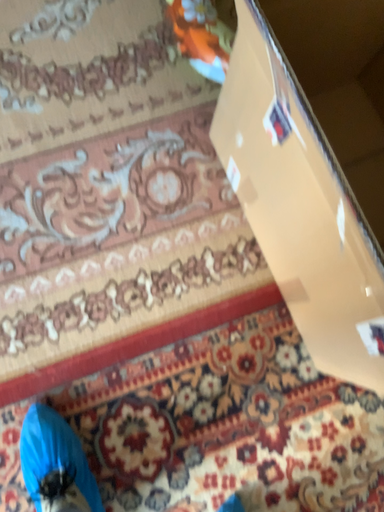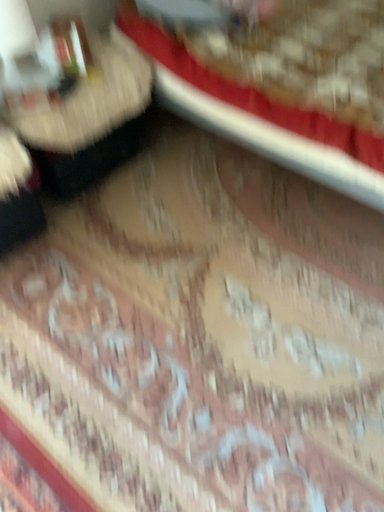
Question: Which way did the camera rotate in the video?

Choices:
 (A) rotated upward
 (B) rotated downward

Answer: (A)